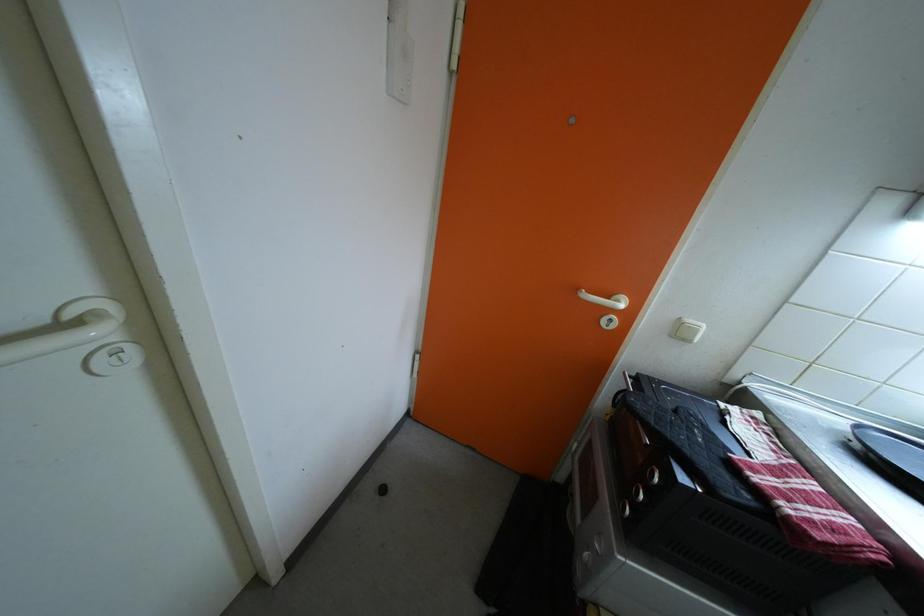
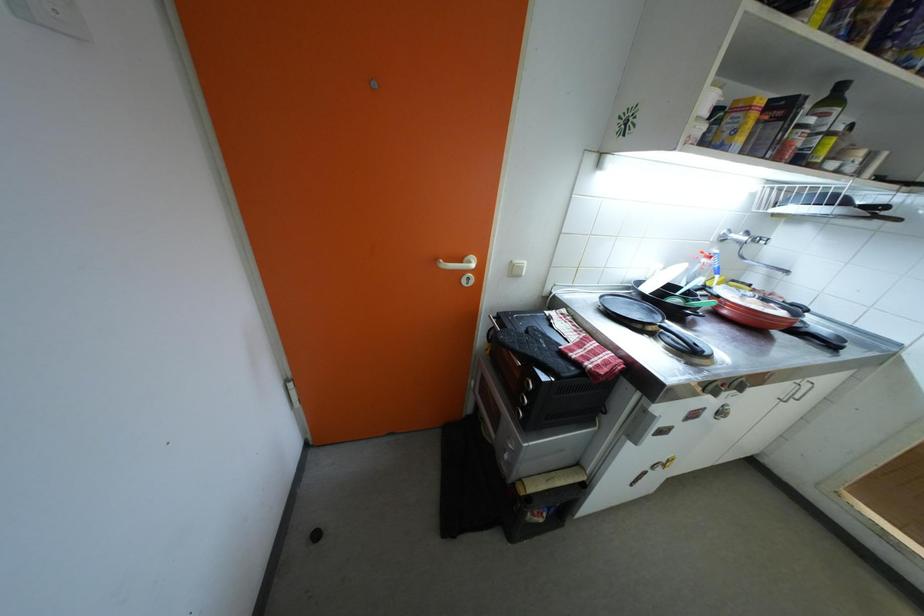
Question: How did the camera likely rotate?

Choices:
 (A) Left
 (B) Right
 (C) Up
 (D) Down

Answer: (B)